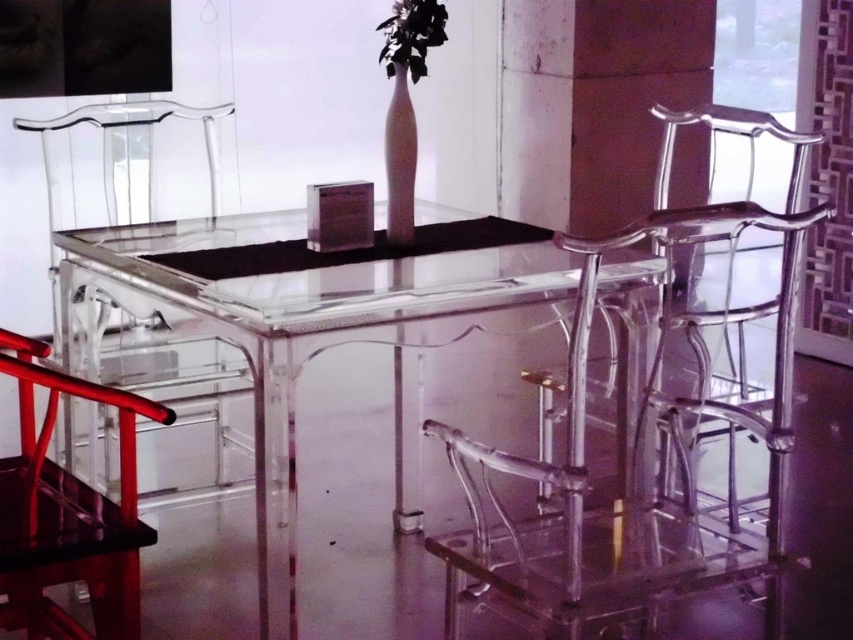
Between transparent acrylic chair at center and transparent acrylic chair at right, which one is positioned lower?

Positioned lower is transparent acrylic chair at center.

Which is more to the left, transparent acrylic chair at center or transparent acrylic chair at right?

transparent acrylic chair at center

The width and height of the screenshot is (853, 640). Describe the element at coordinates (630, 467) in the screenshot. I see `transparent acrylic chair at center` at that location.

At what (x,y) coordinates should I click in order to perform the action: click on transparent acrylic chair at center. Please return your answer as a coordinate pair (x, y). The image size is (853, 640). Looking at the image, I should click on (630, 467).

Which is above, transparent acrylic chair at left or transparent acrylic chair at lower left?

transparent acrylic chair at left is higher up.

What do you see at coordinates (138, 253) in the screenshot? Image resolution: width=853 pixels, height=640 pixels. I see `transparent acrylic chair at left` at bounding box center [138, 253].

In order to click on transparent acrylic chair at left in this screenshot , I will do `click(138, 253)`.

Which is in front, point (120, 552) or point (412, 172)?

Point (120, 552) is more forward.

Who is higher up, transparent acrylic chair at lower left or white glossy vase at center?

Positioned higher is white glossy vase at center.

Does point (71, 380) come farther from viewer compared to point (412, 128)?

No, it is not.

Find the location of a particular element. transparent acrylic chair at lower left is located at coordinates (67, 513).